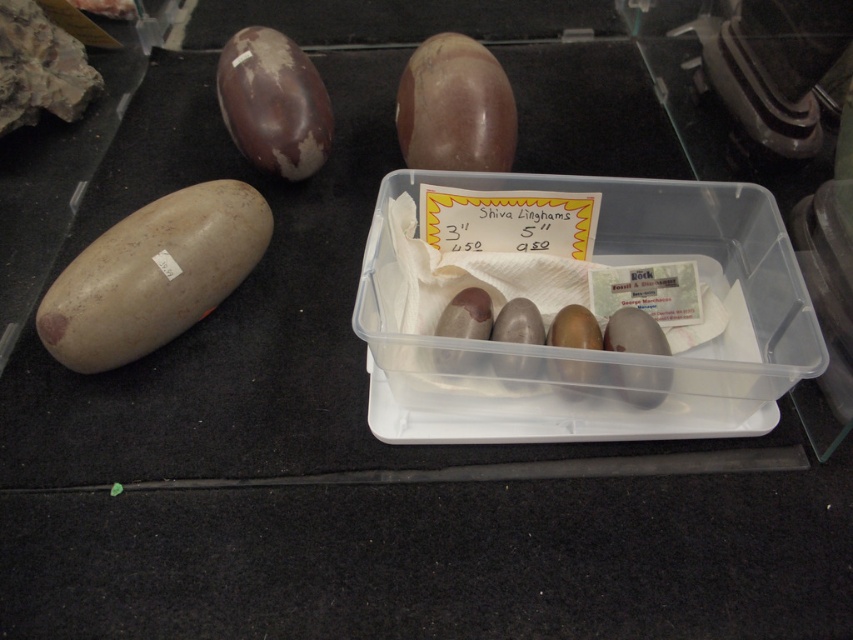
Question: Which point appears closest to the camera in this image?

Choices:
 (A) (461, 166)
 (B) (317, 116)
 (C) (258, 228)

Answer: (C)

Question: Is matte brown potato at left positioned in front of brown matte egg at upper left?

Choices:
 (A) yes
 (B) no

Answer: (A)

Question: Which of the following is the farthest from the observer?

Choices:
 (A) shiny brown stone at upper center
 (B) matte brown potato at left
 (C) brown matte egg at upper left

Answer: (C)

Question: Can you confirm if shiny brown stone at upper center is bigger than brown matte egg at upper left?

Choices:
 (A) yes
 (B) no

Answer: (A)

Question: Does matte brown potato at left have a greater width compared to brown matte egg at upper left?

Choices:
 (A) yes
 (B) no

Answer: (A)

Question: Which point appears closest to the camera in this image?

Choices:
 (A) (148, 298)
 (B) (222, 56)
 (C) (463, 60)

Answer: (A)